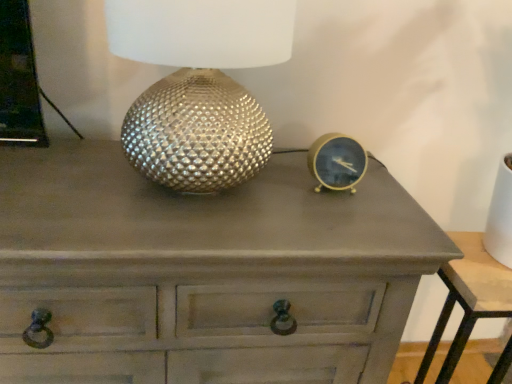
Where is `vacant space in metallic textured lamp at center (from a real-world perspective)`? The height and width of the screenshot is (384, 512). vacant space in metallic textured lamp at center (from a real-world perspective) is located at coordinates pyautogui.click(x=192, y=198).